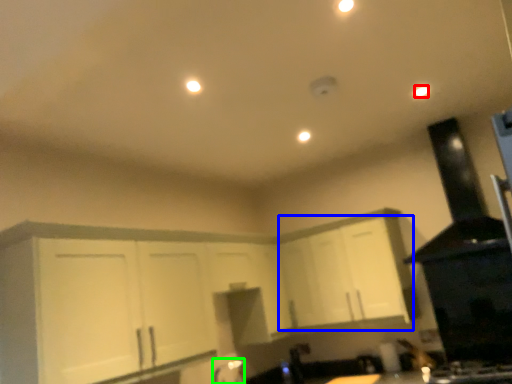
Question: Considering the real-world distances, which object is farthest from light (highlighted by a red box)? cabinetry (highlighted by a blue box) or faucet (highlighted by a green box)?

Choices:
 (A) cabinetry
 (B) faucet

Answer: (B)